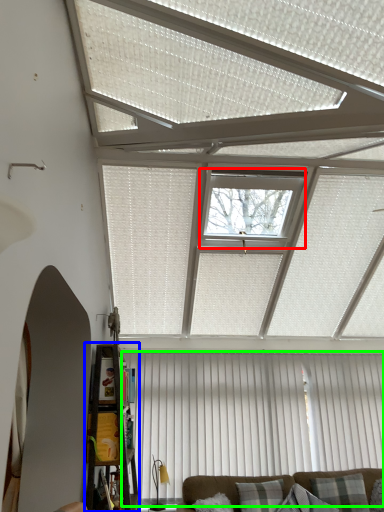
Question: Considering the real-world distances, which object is closest to window (highlighted by a red box)? shelf (highlighted by a blue box) or curtain (highlighted by a green box).

Choices:
 (A) shelf
 (B) curtain

Answer: (A)